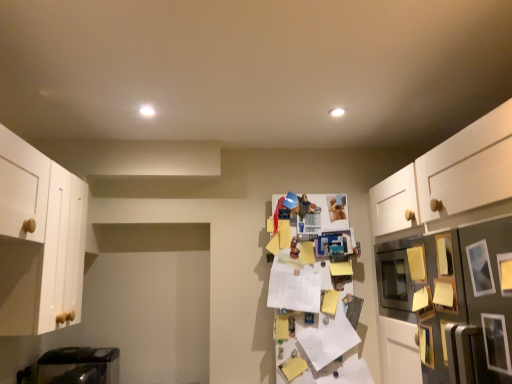
Question: Are wooden picture frame at lower right, which is the fifth picture frame from front to back, and yellow paper at center, the first shelf in the left-to-right sequence, beside each other?

Choices:
 (A) no
 (B) yes

Answer: (A)

Question: From a real-world perspective, is wooden picture frame at lower right, which is the fifth picture frame from front to back, located higher than yellow paper at center, the second shelf when ordered from front to back?

Choices:
 (A) yes
 (B) no

Answer: (B)

Question: Does wooden picture frame at lower right, which is the fifth picture frame from front to back, have a greater height compared to yellow paper at center, marked as the second shelf in a right-to-left arrangement?

Choices:
 (A) no
 (B) yes

Answer: (A)

Question: Can you confirm if wooden picture frame at lower right, arranged as the first picture frame when viewed from the back, is shorter than yellow paper at center, which appears as the first shelf when viewed from the back?

Choices:
 (A) yes
 (B) no

Answer: (A)

Question: From the image's perspective, would you say wooden picture frame at lower right, which is the fifth picture frame from front to back, is positioned over yellow paper at center, the first shelf in the left-to-right sequence?

Choices:
 (A) no
 (B) yes

Answer: (A)

Question: From a real-world perspective, does wooden picture frame at lower right, which is the fifth picture frame from front to back, sit lower than yellow paper at center, marked as the second shelf in a right-to-left arrangement?

Choices:
 (A) no
 (B) yes

Answer: (B)

Question: Can you confirm if wooden picture frame at right, which is the first picture frame in front-to-back order, is wider than metallic silver picture frame at right, the third picture frame positioned from the front?

Choices:
 (A) no
 (B) yes

Answer: (A)

Question: Is wooden picture frame at right, which is the first picture frame in front-to-back order, to the left of metallic silver picture frame at right, marked as the 3th picture frame in a back-to-front arrangement, from the viewer's perspective?

Choices:
 (A) no
 (B) yes

Answer: (A)

Question: Is wooden picture frame at right, which is the first picture frame in front-to-back order, further to camera compared to metallic silver picture frame at right, marked as the 3th picture frame in a back-to-front arrangement?

Choices:
 (A) yes
 (B) no

Answer: (B)

Question: From a real-world perspective, is wooden picture frame at right, the fifth picture frame viewed from the back, below metallic silver picture frame at right, the third picture frame positioned from the front?

Choices:
 (A) no
 (B) yes

Answer: (B)

Question: Does wooden picture frame at right, which is the first picture frame in front-to-back order, have a greater height compared to metallic silver picture frame at right, marked as the 3th picture frame in a back-to-front arrangement?

Choices:
 (A) no
 (B) yes

Answer: (A)

Question: Considering the relative positions of wooden picture frame at right, which is the first picture frame in front-to-back order, and metallic silver picture frame at right, marked as the 3th picture frame in a back-to-front arrangement, in the image provided, is wooden picture frame at right, which is the first picture frame in front-to-back order, to the right of metallic silver picture frame at right, marked as the 3th picture frame in a back-to-front arrangement, from the viewer's perspective?

Choices:
 (A) no
 (B) yes

Answer: (B)

Question: Can we say wooden picture frame at right, acting as the 4th picture frame starting from the front, lies outside metallic silver refrigerator at right, the first shelf from the right?

Choices:
 (A) yes
 (B) no

Answer: (B)